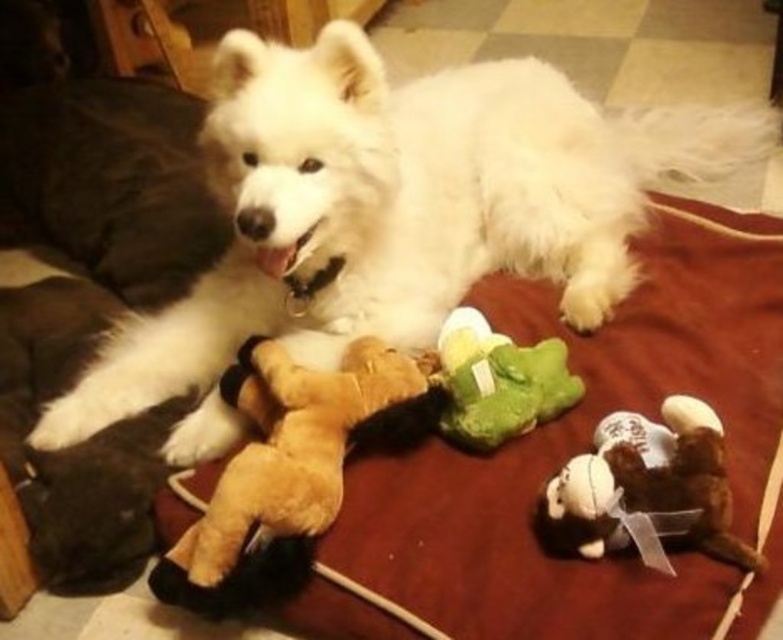
You need to place a new small toy between the white fluffy dog at upper center and the brown plush bear at lower left. Based on their sizes, which object should the toy be closer to?

The white fluffy dog at upper center is larger than the brown plush bear at lower left, so the new small toy should be placed closer to the brown plush bear at lower left to maintain balance.

You are a pet sitter who needs to place a new toy for the dog. The new toy is 5 inches in diameter. If you want to place it between the white fluffy dog at upper center and the brown plush bear at lower right, will there be enough space?

The distance between the white fluffy dog at upper center and the brown plush bear at lower right is 20.05 inches. Since the new toy is only 5 inches in diameter, there will be ample space to place it between them.